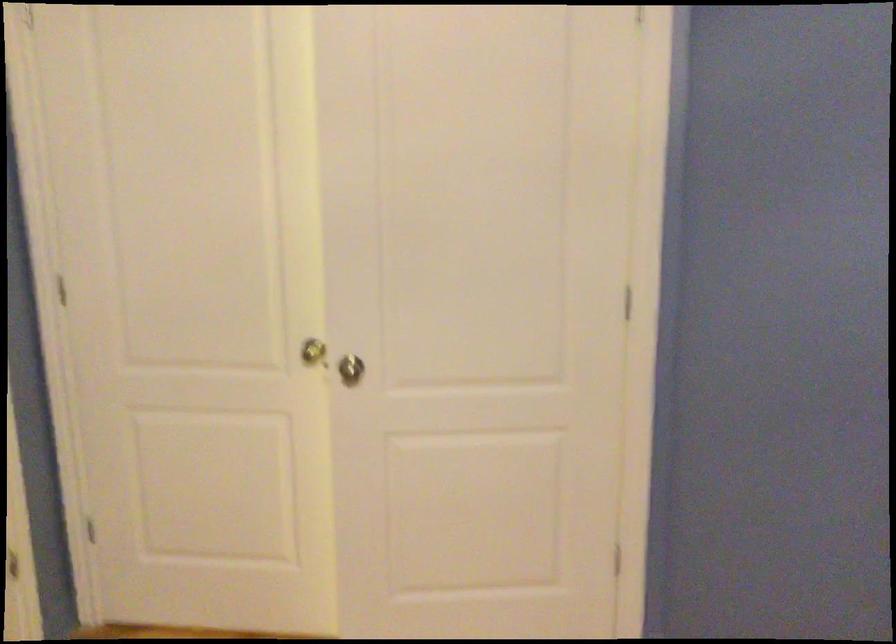
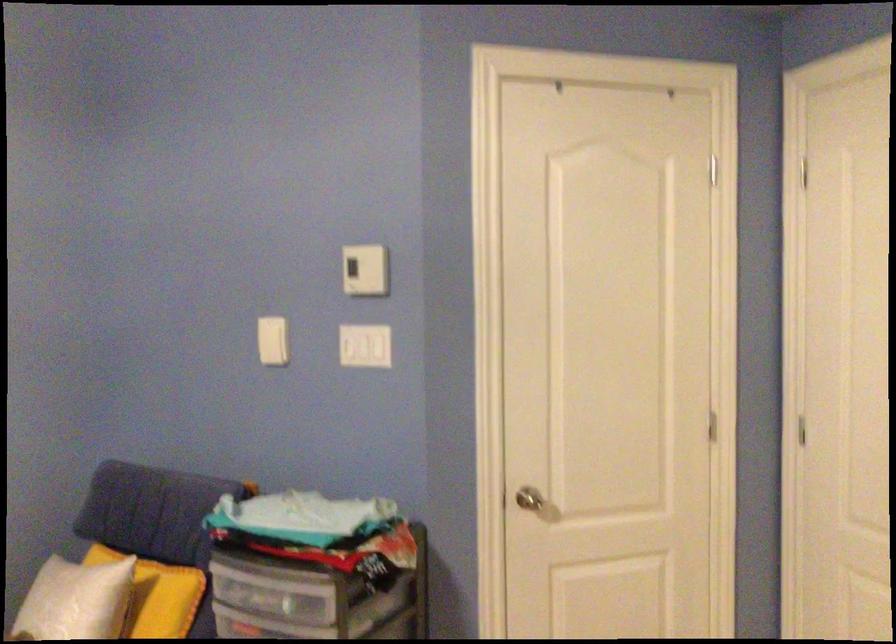
Question: The camera is either moving clockwise (left) or counter-clockwise (right) around the object. The first image is from the beginning of the video and the second image is from the end. Is the camera moving left or right when shooting the video?

Choices:
 (A) Left
 (B) Right

Answer: (B)